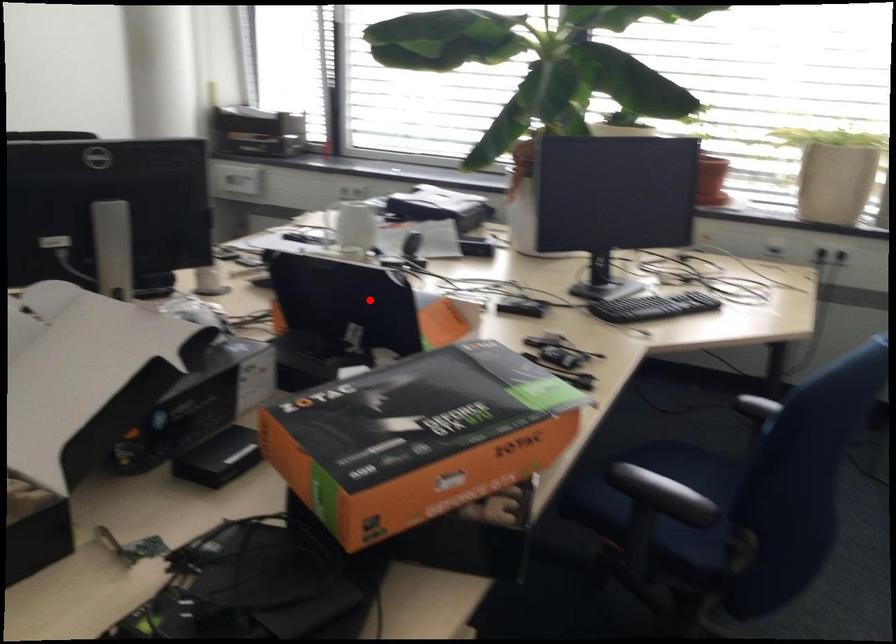
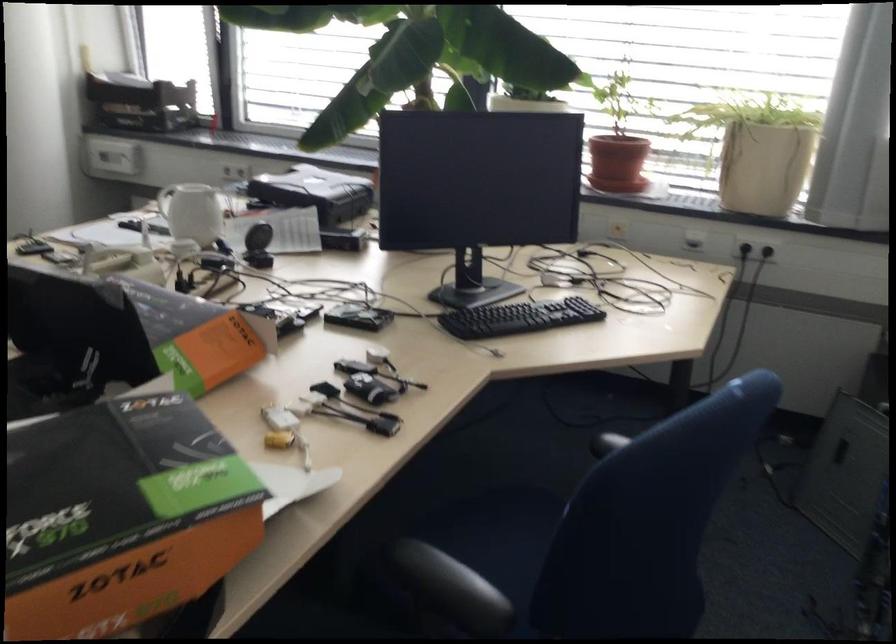
Question: I am providing you with two images of the same scene from different viewpoints. In image1, a red point is highlighted. Considering the same 3D point in image2, which of the following is correct?

Choices:
 (A) It is closer
 (B) It is farther

Answer: (A)